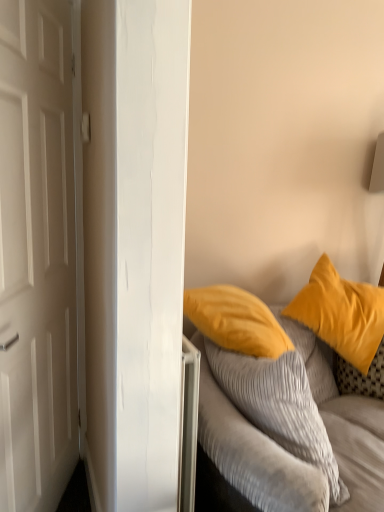
Question: In terms of width, does matte yellow pillow at upper right look wider or thinner when compared to white matte door at left?

Choices:
 (A) wide
 (B) thin

Answer: (A)

Question: Is matte yellow pillow at upper right inside or outside of white matte door at left?

Choices:
 (A) inside
 (B) outside

Answer: (B)

Question: Estimate the real-world distances between objects in this image. Which object is farther from the soft yellow pillow at right?

Choices:
 (A) matte yellow pillow at upper right
 (B) white matte door at left

Answer: (B)

Question: Based on their relative distances, which object is farther from the soft yellow pillow at right?

Choices:
 (A) white matte door at left
 (B) matte yellow pillow at upper right

Answer: (A)